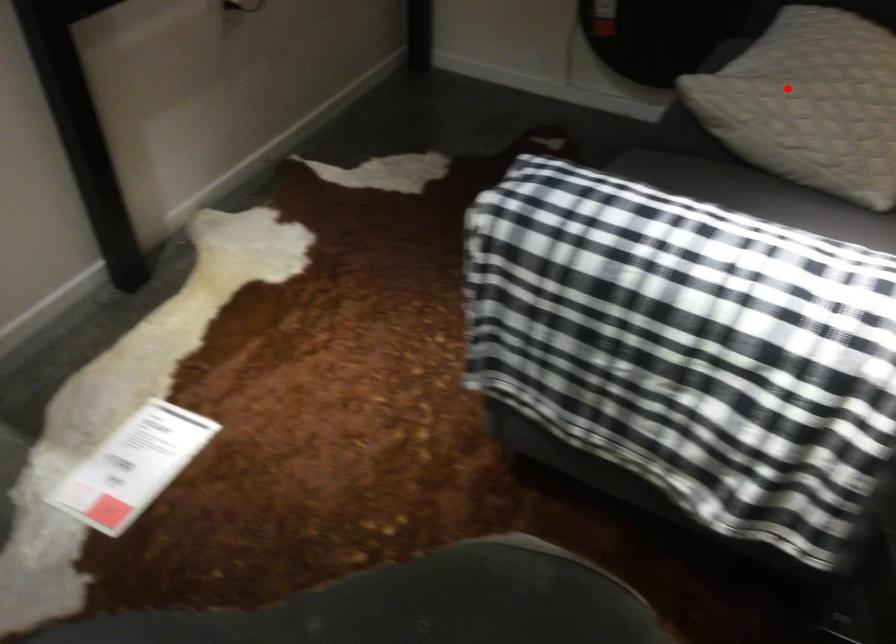
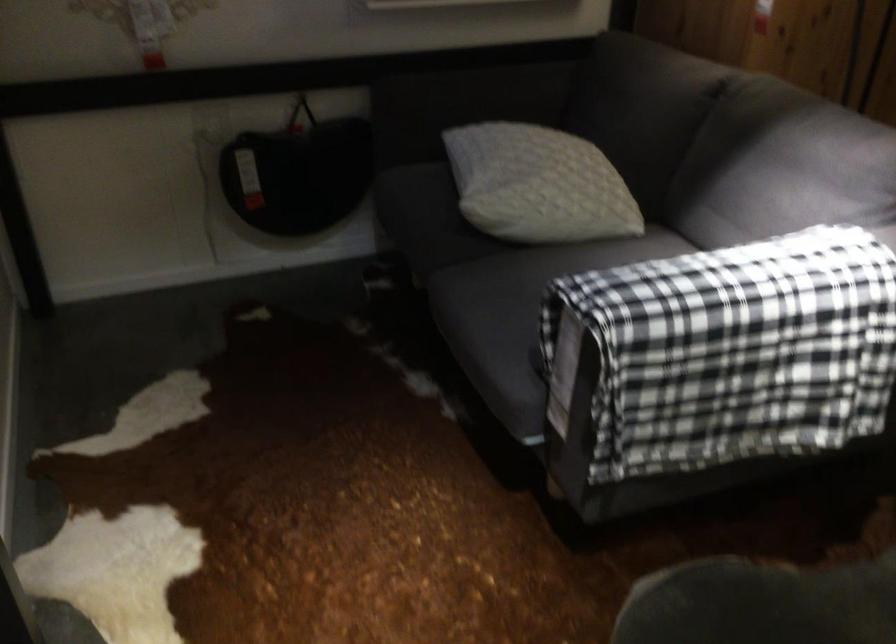
Where in the second image is the point corresponding to the highlighted location from the first image?

(538, 185)